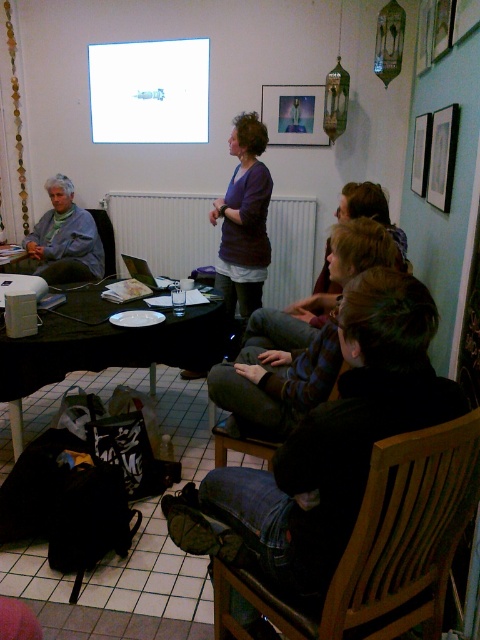
Question: Does wooden chair at lower right appear under matte glass picture frame at upper center?

Choices:
 (A) no
 (B) yes

Answer: (B)

Question: Which point is closer to the camera?

Choices:
 (A) white matte radiator at center
 (B) matte gray sweater at left
 (C) white glossy projector screen at upper center
 (D) matte glass picture frame at upper center

Answer: (B)

Question: Considering the relative positions of white matte radiator at center and matte glass picture frame at upper center in the image provided, where is white matte radiator at center located with respect to matte glass picture frame at upper center?

Choices:
 (A) below
 (B) above

Answer: (A)

Question: Which point is closer to the camera?

Choices:
 (A) matte gray sweater at left
 (B) wooden chair at lower right
 (C) black plastic table at center

Answer: (B)

Question: Which object is farther from the camera taking this photo?

Choices:
 (A) purple matte shirt at center
 (B) white glossy projector screen at upper center
 (C) matte black chair at left

Answer: (C)

Question: Is white glossy projector screen at upper center to the left of matte glass picture frame at upper center from the viewer's perspective?

Choices:
 (A) no
 (B) yes

Answer: (B)